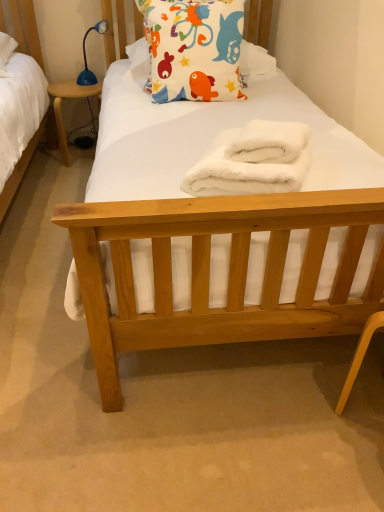
What are the coordinates of `white fluffy towel at center` in the screenshot? It's located at (254, 162).

Measure the distance between point (303, 132) and camera.

They are 1.16 meters apart.

The width and height of the screenshot is (384, 512). In order to click on white fabric pillow with colorful fish designs at upper center in this screenshot , I will do `click(194, 48)`.

Locate an element on the screen. Image resolution: width=384 pixels, height=512 pixels. blue plastic lamp at upper left is located at coordinates (86, 58).

Locate an element on the screen. Image resolution: width=384 pixels, height=512 pixels. blue plastic desk at left is located at coordinates (61, 108).

Could you tell me if blue plastic lamp at upper left is facing white fabric pillow with colorful fish designs at upper center?

No.

Who is taller, blue plastic lamp at upper left or white fabric pillow with colorful fish designs at upper center?

Standing taller between the two is white fabric pillow with colorful fish designs at upper center.

Which object is positioned more to the left, blue plastic lamp at upper left or white fabric pillow with colorful fish designs at upper center?

blue plastic lamp at upper left is more to the left.

Which object is closer to the camera taking this photo, blue plastic lamp at upper left or white fabric pillow with colorful fish designs at upper center?

white fabric pillow with colorful fish designs at upper center.

Does white fabric pillow with colorful fish designs at upper center have a larger size compared to white fluffy towel at center?

Indeed, white fabric pillow with colorful fish designs at upper center has a larger size compared to white fluffy towel at center.

Is white fabric pillow with colorful fish designs at upper center far away from white fluffy towel at center?

white fabric pillow with colorful fish designs at upper center is actually quite close to white fluffy towel at center.

Which object is closer to the camera, white fabric pillow with colorful fish designs at upper center or white fluffy towel at center?

white fluffy towel at center is in front.

Is white fabric pillow with colorful fish designs at upper center oriented away from white fluffy towel at center?

white fabric pillow with colorful fish designs at upper center does not have its back to white fluffy towel at center.

Could you tell me if white fabric pillow with colorful fish designs at upper center is facing blue plastic lamp at upper left?

No, white fabric pillow with colorful fish designs at upper center does not turn towards blue plastic lamp at upper left.

Between white fabric pillow with colorful fish designs at upper center and blue plastic lamp at upper left, which one is positioned behind?

blue plastic lamp at upper left is behind.

Which is farther from the camera, (151, 14) or (85, 82)?

The point (85, 82) is behind.

In the scene shown: From the image's perspective, is white fabric pillow with colorful fish designs at upper center located above or below blue plastic lamp at upper left?

white fabric pillow with colorful fish designs at upper center is below blue plastic lamp at upper left.

Considering the positions of objects white fabric pillow with colorful fish designs at upper center and white fluffy bath towel at center in the image provided, who is more to the right, white fabric pillow with colorful fish designs at upper center or white fluffy bath towel at center?

white fluffy bath towel at center.

Is white fabric pillow with colorful fish designs at upper center oriented towards white fluffy bath towel at center?

Yes, white fabric pillow with colorful fish designs at upper center is oriented towards white fluffy bath towel at center.

In terms of height, does white fabric pillow with colorful fish designs at upper center look taller or shorter compared to white fluffy bath towel at center?

In the image, white fabric pillow with colorful fish designs at upper center appears to be taller than white fluffy bath towel at center.

Considering the relative positions of blue plastic lamp at upper left and white fluffy towel at center in the image provided, is blue plastic lamp at upper left to the left of white fluffy towel at center from the viewer's perspective?

Yes.

Is blue plastic lamp at upper left facing away from white fluffy towel at center?

No, blue plastic lamp at upper left is not facing away from white fluffy towel at center.

Does blue plastic lamp at upper left touch white fluffy towel at center?

They are not placed beside each other.

Does point (102, 29) appear closer or farther from the camera than point (207, 164)?

Point (102, 29).

Which object is further away from the camera, white fluffy towel at center or blue plastic lamp at upper left?

blue plastic lamp at upper left is more distant.

Is white fluffy towel at center not within blue plastic lamp at upper left?

Yes, white fluffy towel at center is located beyond the bounds of blue plastic lamp at upper left.

Considering the sizes of white fluffy towel at center and blue plastic lamp at upper left in the image, is white fluffy towel at center taller or shorter than blue plastic lamp at upper left?

In the image, white fluffy towel at center appears to be shorter than blue plastic lamp at upper left.

From a real-world perspective, which is physically below, blue plastic lamp at upper left or white fluffy bath towel at center?

blue plastic lamp at upper left.

From the image's perspective, who appears lower, blue plastic lamp at upper left or white fluffy bath towel at center?

white fluffy bath towel at center is shown below in the image.

The image size is (384, 512). I want to click on bath towel located above the blue plastic lamp at upper left (from a real-world perspective), so click(x=269, y=142).

Considering the relative sizes of blue plastic lamp at upper left and white fluffy bath towel at center in the image provided, is blue plastic lamp at upper left taller than white fluffy bath towel at center?

Yes, blue plastic lamp at upper left is taller than white fluffy bath towel at center.

The height and width of the screenshot is (512, 384). Find the location of `lamp above the white fabric pillow with colorful fish designs at upper center (from the image's perspective)`. lamp above the white fabric pillow with colorful fish designs at upper center (from the image's perspective) is located at coordinates (86, 58).

You are a GUI agent. You are given a task and a screenshot of the screen. Output one action in this format:
    pyautogui.click(x=<x>, y=<y>)
    Task: Click on the towel/napkin that is in front of the white fabric pillow with colorful fish designs at upper center
    
    Given the screenshot: What is the action you would take?
    pyautogui.click(x=254, y=162)

Looking at the image, which one is located closer to white fluffy bath towel at center, white fluffy towel at center or blue plastic lamp at upper left?

white fluffy towel at center lies closer to white fluffy bath towel at center than the other object.

Consider the image. From the image, which object appears to be nearer to blue plastic desk at left, blue plastic lamp at upper left or white fluffy towel at center?

Based on the image, blue plastic lamp at upper left appears to be nearer to blue plastic desk at left.

Looking at the image, which one is located further to blue plastic desk at left, white fluffy bath towel at center or white fluffy towel at center?

Based on the image, white fluffy bath towel at center appears to be further to blue plastic desk at left.

In the scene shown: From the image, which object appears to be farther from white fluffy towel at center, white fabric pillow with colorful fish designs at upper center or blue plastic desk at left?

blue plastic desk at left is positioned further to the anchor white fluffy towel at center.

Based on their spatial positions, is white fluffy towel at center or blue plastic desk at left closer to white fabric pillow with colorful fish designs at upper center?

Based on the image, white fluffy towel at center appears to be nearer to white fabric pillow with colorful fish designs at upper center.

Based on their spatial positions, is blue plastic lamp at upper left or white fabric pillow with colorful fish designs at upper center closer to white fluffy towel at center?

white fabric pillow with colorful fish designs at upper center lies closer to white fluffy towel at center than the other object.

Based on their spatial positions, is blue plastic desk at left or white fluffy towel at center further from white fluffy bath towel at center?

blue plastic desk at left is positioned further to the anchor white fluffy bath towel at center.

Looking at the image, which one is located further to white fabric pillow with colorful fish designs at upper center, white fluffy towel at center or white fluffy bath towel at center?

white fluffy towel at center.

At what (x,y) coordinates should I click in order to perform the action: click on pillow between white fluffy towel at center and blue plastic desk at left in the front-back direction. Please return your answer as a coordinate pair (x, y). The width and height of the screenshot is (384, 512). Looking at the image, I should click on (194, 48).

Where is `pillow between white fluffy towel at center and blue plastic lamp at upper left in the front-back direction`? The height and width of the screenshot is (512, 384). pillow between white fluffy towel at center and blue plastic lamp at upper left in the front-back direction is located at coordinates (194, 48).

At what (x,y) coordinates should I click in order to perform the action: click on bath towel between white fluffy towel at center and white fabric pillow with colorful fish designs at upper center in the front-back direction. Please return your answer as a coordinate pair (x, y). The height and width of the screenshot is (512, 384). Looking at the image, I should click on (269, 142).

Find the location of `lamp between white fluffy bath towel at center and blue plastic desk at left in the front-back direction`. lamp between white fluffy bath towel at center and blue plastic desk at left in the front-back direction is located at coordinates (86, 58).